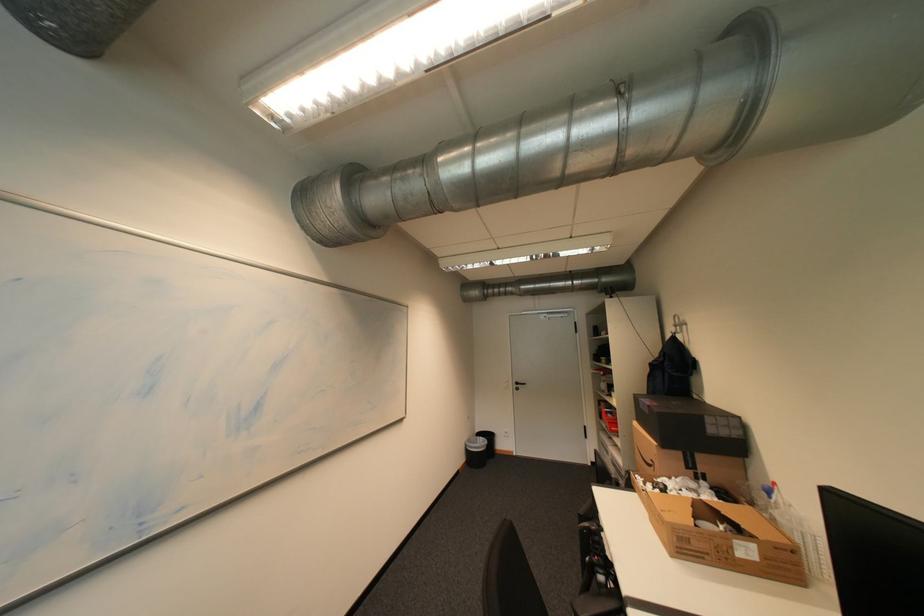
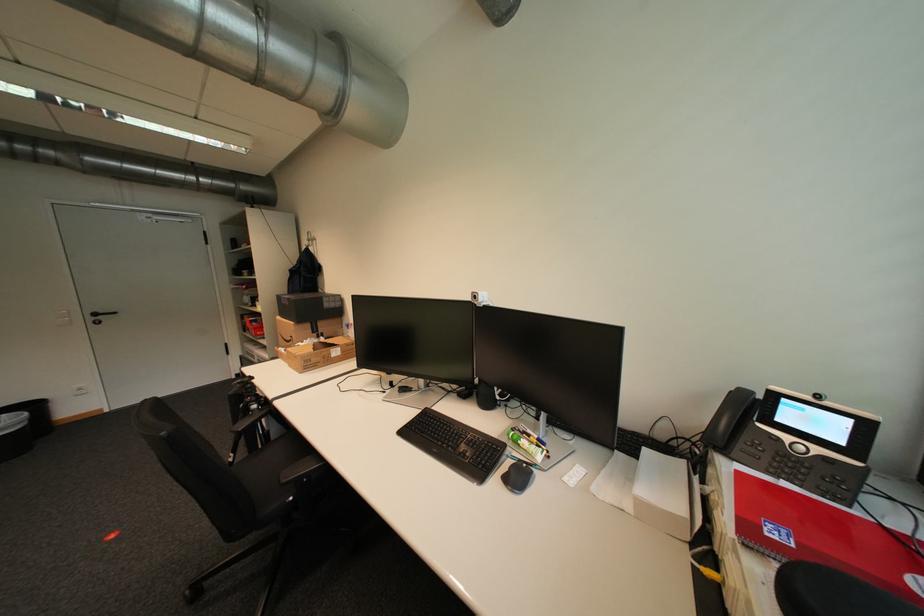
The point at (526, 384) is marked in the first image. Where is the corresponding point in the second image?

(103, 315)